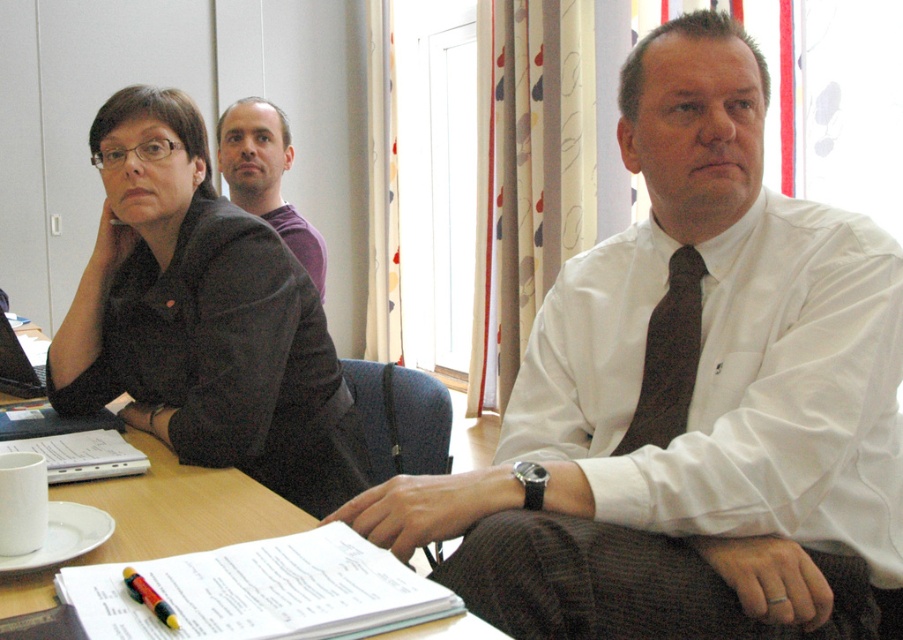
You are a photographer setting up for a group photo in the meeting room. You need to ensure that both the white cotton dress shirt at center and the matte black shirt at upper left are fully visible in the frame. Based on their current positions, is there any part of either shirt that might be blocked from view?

The white cotton dress shirt at center is positioned under the matte black shirt at upper left, so part of the white cotton dress shirt at center could be blocked by the matte black shirt at upper left. Adjust the subjects positions to ensure both shirts are fully visible.

You are organizing a meeting and need to place a name tag on the table. The name tag must be placed below the purple cotton shirt at upper center. Where should you place it in relation to the multicolored plastic pen at lower left?

The name tag should be placed below the purple cotton shirt at upper center, which is above the multicolored plastic pen at lower left. Therefore, the name tag should be placed above the multicolored plastic pen at lower left.